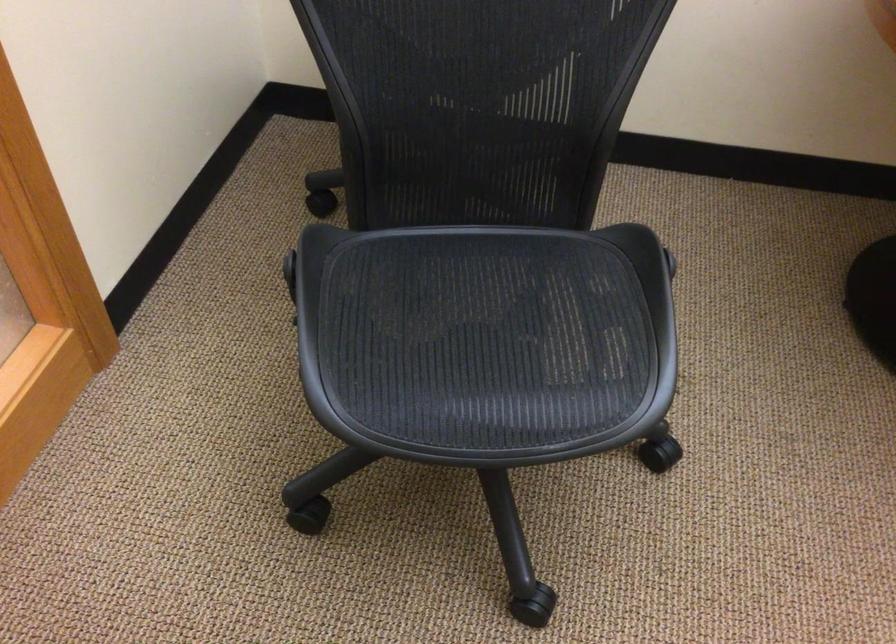
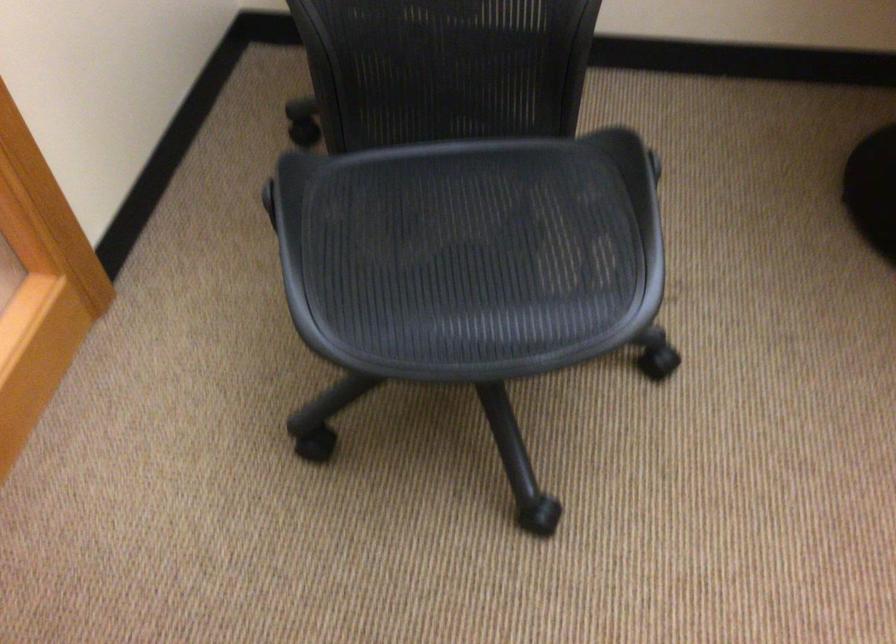
In the second image, find the point that corresponds to point 484,339 in the first image.

(470, 254)